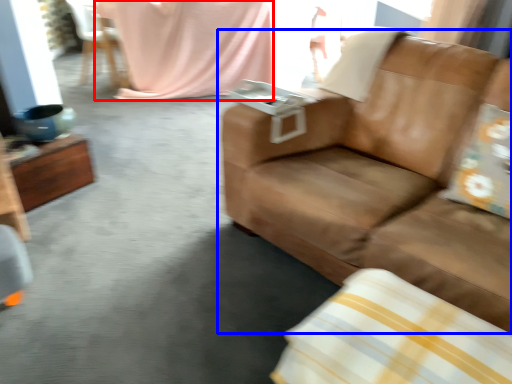
Question: Which object is closer to the camera taking this photo, blanket (highlighted by a red box) or studio couch (highlighted by a blue box)?

Choices:
 (A) blanket
 (B) studio couch

Answer: (B)